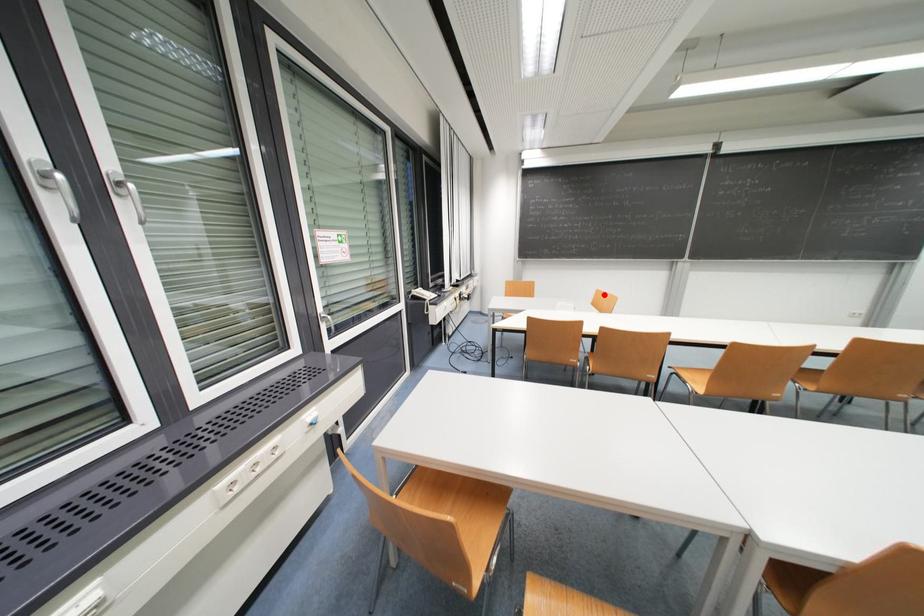
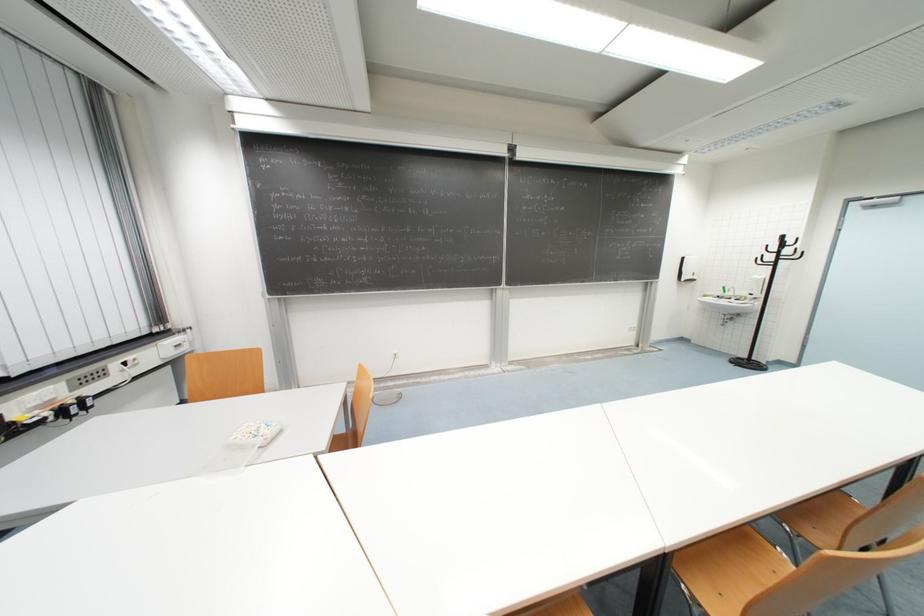
In the second image, find the point that corresponds to the highlighted location in the first image.

(369, 371)